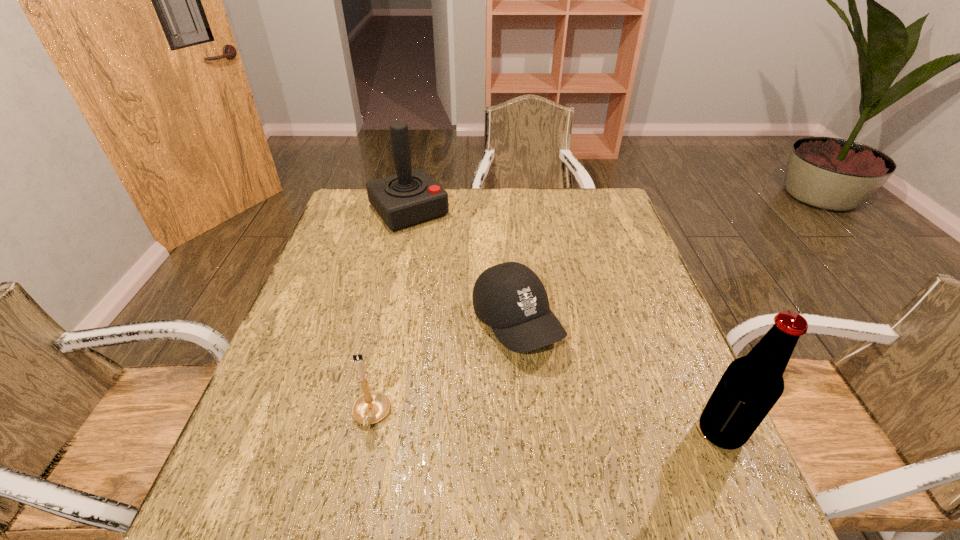
Locate an element on the screen. The width and height of the screenshot is (960, 540). free spot between the joystick and the baseball cap is located at coordinates (463, 267).

Where is `free space between the beer bottle and the shortest object`? free space between the beer bottle and the shortest object is located at coordinates (618, 378).

Locate an element on the screen. The width and height of the screenshot is (960, 540). vacant area that lies between the candle holder and the joystick is located at coordinates (390, 313).

Where is `empty space that is in between the baseball cap and the joystick`? empty space that is in between the baseball cap and the joystick is located at coordinates (x=463, y=267).

This screenshot has height=540, width=960. What are the coordinates of `free space that is in between the farthest object and the second shortest object` in the screenshot? It's located at (390, 313).

Locate which object ranks third in proximity to the second shortest object. Please provide its 2D coordinates. Your answer should be formatted as a tuple, i.e. [(x, y)], where the tuple contains the x and y coordinates of a point satisfying the conditions above.

[(751, 385)]

At what (x,y) coordinates should I click in order to perform the action: click on the third closest object to the rightmost object. Please return your answer as a coordinate pair (x, y). The height and width of the screenshot is (540, 960). Looking at the image, I should click on (411, 197).

What are the coordinates of `free point that satisfies the following two spatial constraints: 1. on the handle side of the rightmost object; 2. on the left side of the second shortest object` in the screenshot? It's located at (368, 432).